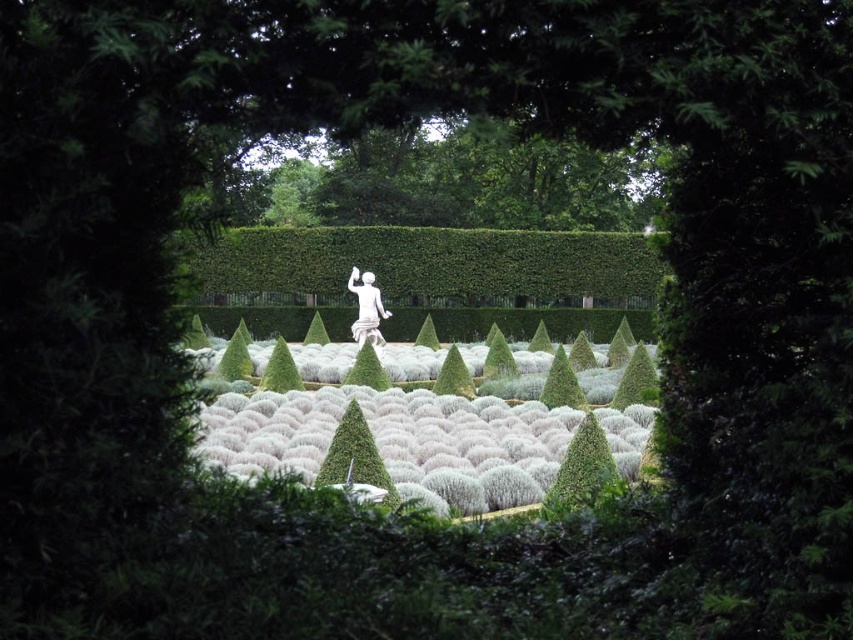
Is point (583, 432) positioned after point (352, 275)?

No, (583, 432) is closer to viewer.

Is green leafy bush at center to the right of white marble statue at center from the viewer's perspective?

Indeed, green leafy bush at center is positioned on the right side of white marble statue at center.

Describe the element at coordinates (583, 470) in the screenshot. I see `green leafy bush at center` at that location.

Find the location of `green leafy bush at center`. green leafy bush at center is located at coordinates (583, 470).

Is green leafy hedge at center positioned in front of green textured bush at center?

Yes.

Which is in front, point (379, 282) or point (318, 476)?

Point (318, 476)

Where is `green leafy hedge at center`? The width and height of the screenshot is (853, 640). green leafy hedge at center is located at coordinates (427, 266).

Is green leafy hedge at center to the left of green leafy bush at center from the viewer's perspective?

Yes, green leafy hedge at center is to the left of green leafy bush at center.

Can you confirm if green leafy hedge at center is positioned above green leafy bush at center?

Yes, green leafy hedge at center is above green leafy bush at center.

Does point (422, 269) lie behind point (569, 458)?

Yes, it is behind point (569, 458).

At what (x,y) coordinates should I click in order to perform the action: click on green leafy hedge at center. Please return your answer as a coordinate pair (x, y). Looking at the image, I should click on (427, 266).